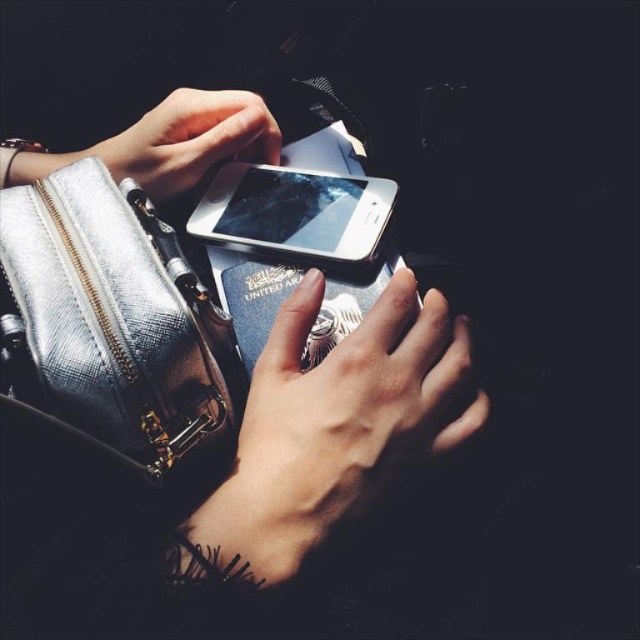
What do you see at coordinates (120, 323) in the screenshot?
I see `metallic silver handbag at left` at bounding box center [120, 323].

The width and height of the screenshot is (640, 640). In order to click on metallic silver handbag at left in this screenshot , I will do `click(120, 323)`.

Find the location of `metallic silver handbag at left`. metallic silver handbag at left is located at coordinates (120, 323).

Does smooth metallic hand at center appear on the right side of shiny silver phone at center?

Yes, smooth metallic hand at center is to the right of shiny silver phone at center.

Is point (284, 396) farther from camera compared to point (228, 232)?

No, (284, 396) is closer to viewer.

Who is more distant from viewer, (x=196, y=564) or (x=252, y=205)?

Point (x=252, y=205)

Identify the location of smooth metallic hand at center. The image size is (640, 640). (333, 426).

Does metallic silver purse at upper left lie in front of smooth metallic hand at center?

That is True.

The width and height of the screenshot is (640, 640). Describe the element at coordinates (324, 426) in the screenshot. I see `metallic silver purse at upper left` at that location.

The height and width of the screenshot is (640, 640). Identify the location of metallic silver purse at upper left. (324, 426).